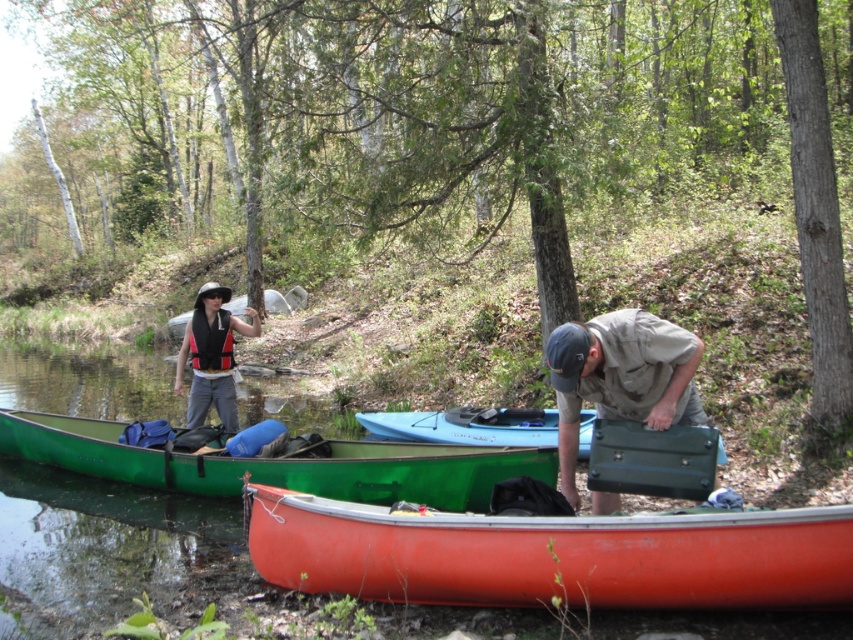
Is point (718, 589) closer to camera compared to point (636, 412)?

Yes.

Which is below, smooth orange canoe at lower center or green matte briefcase at lower center?

smooth orange canoe at lower center is below.

Does point (349, 532) come closer to viewer compared to point (621, 364)?

No, it is not.

Find the location of a particular element. This screenshot has height=640, width=853. smooth orange canoe at lower center is located at coordinates (552, 554).

Is smooth orange canoe at lower center shorter than green matte canoe at lower left?

Incorrect, smooth orange canoe at lower center's height does not fall short of green matte canoe at lower left's.

Does smooth orange canoe at lower center have a greater height compared to green matte canoe at lower left?

Yes.

Does point (339, 506) come farther from viewer compared to point (430, 465)?

No, (339, 506) is closer to viewer.

What are the coordinates of `smooth orange canoe at lower center` in the screenshot? It's located at (552, 554).

Based on the photo, who is taller, smooth orange canoe at lower center or light blue plastic canoe at center?

smooth orange canoe at lower center is taller.

Which is below, smooth orange canoe at lower center or light blue plastic canoe at center?

smooth orange canoe at lower center is below.

Between point (625, 524) and point (416, 432), which one is positioned behind?

The point (416, 432) is behind.

Where is `smooth orange canoe at lower center`? smooth orange canoe at lower center is located at coordinates (552, 554).